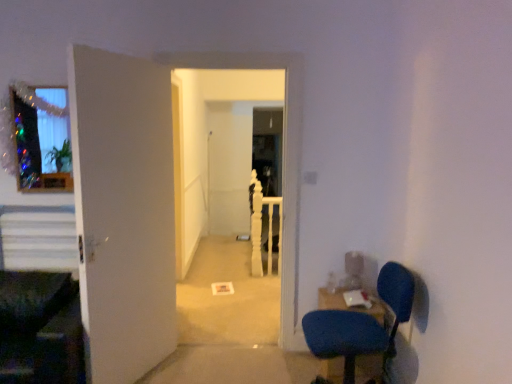
The width and height of the screenshot is (512, 384). In order to click on vacant space to the right of white matte carpet at center in this screenshot , I will do `click(276, 357)`.